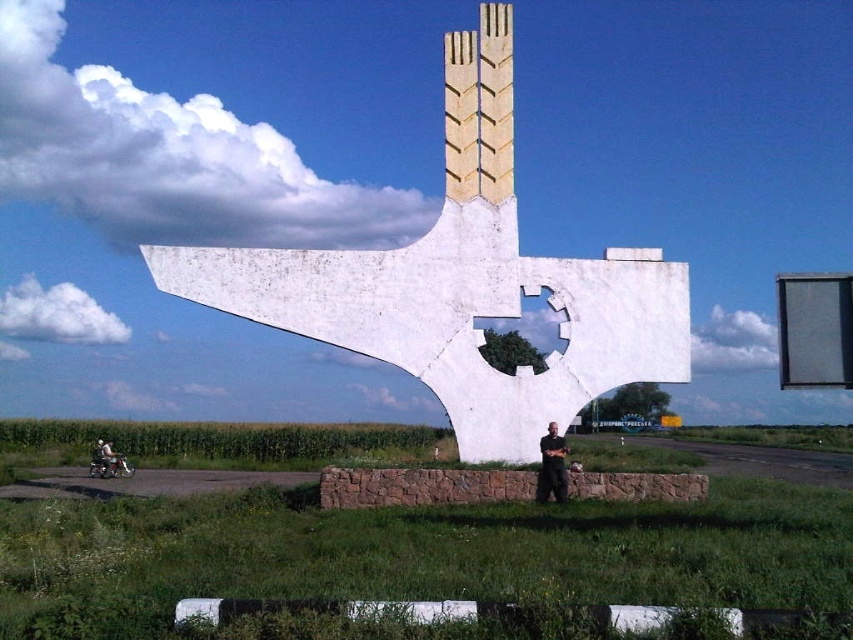
Question: Can you confirm if white concrete sculpture at center is thinner than black fabric pants at center?

Choices:
 (A) yes
 (B) no

Answer: (B)

Question: Is white concrete sculpture at center to the right of black fabric pants at center from the viewer's perspective?

Choices:
 (A) yes
 (B) no

Answer: (B)

Question: Which point is farther from the camera taking this photo?

Choices:
 (A) tap(544, 445)
 (B) tap(543, 417)

Answer: (B)

Question: Among these points, which one is farthest from the camera?

Choices:
 (A) (560, 448)
 (B) (483, 440)
 (C) (108, 461)

Answer: (C)

Question: Which object is positioned farthest from the shiny chrome motorcycle at lower left?

Choices:
 (A) white concrete sculpture at center
 (B) black fabric pants at center

Answer: (B)

Question: Is the position of white concrete sculpture at center more distant than that of shiny chrome motorcycle at lower left?

Choices:
 (A) no
 (B) yes

Answer: (A)